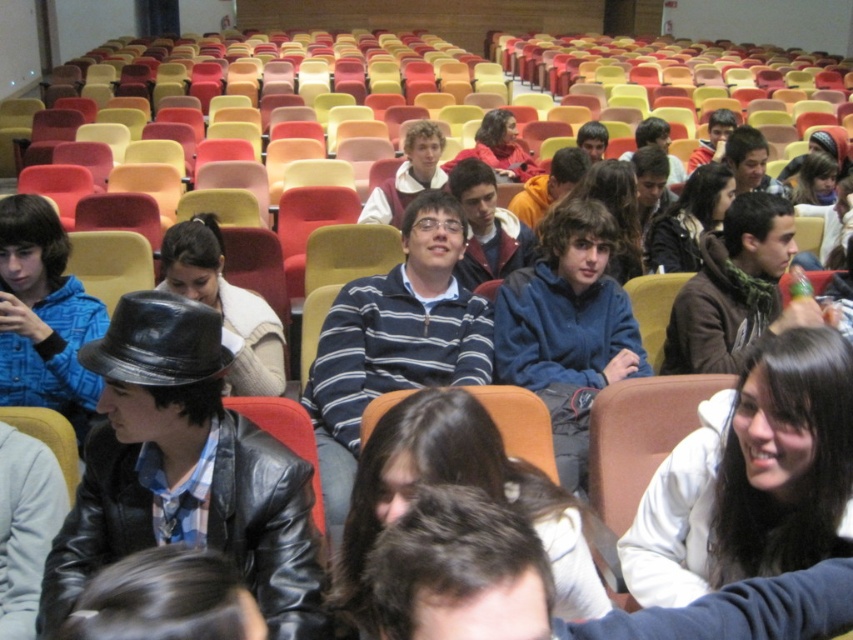
In the scene shown: You are a photographer trying to capture a candid shot of the brown leather jacket at center and the leather hat at center from the front row. Since you want to ensure both are clearly visible in the frame, which object should you focus on first considering their sizes?

The brown leather jacket at center has a smaller size compared to the leather hat at center, so you should focus on the leather hat at center first to ensure it is in clear focus before adjusting for the smaller jacket.

You are a photographer standing at the back of the lecture hall. You want to take a photo that includes both the black leather hat at center and the striped sweater at center. Given that your camera has a maximum zoom range that can capture objects up to 3 meters apart, will you be able to capture both in a single frame?

The black leather hat at center and striped sweater at center are 2.52 meters apart from each other. Since the camera can capture objects up to 3 meters apart, you can capture both in a single frame.

You are standing at the front of the lecture hall and want to identify the exact location of the brown fleece jacket at center right. Using the coordinate system where the bottom left corner is the origin, can you determine if the point representing its position, point (x=735, y=289), is closer to the front or the back of the room?

The point (x=735, y=289) has a y coordinate of 0.863, which is closer to 1.0 than to 0.0. Since the coordinate system has the origin at the bottom left corner, the y axis increases upward. Therefore, the brown fleece jacket at center right is closer to the bottom of the image, which corresponds to the front of the room.